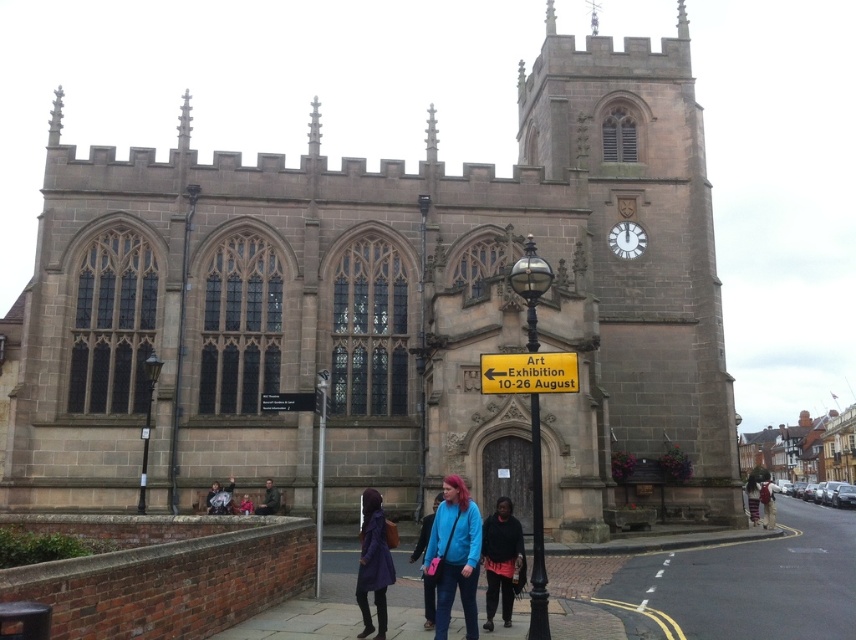
Does blue fabric jacket at center have a lesser width compared to white glossy clock at upper right?

No, blue fabric jacket at center is not thinner than white glossy clock at upper right.

Between blue fabric jacket at center and white glossy clock at upper right, which one has less height?

white glossy clock at upper right

Does point (420, 531) come closer to viewer compared to point (628, 230)?

Yes, it is in front of point (628, 230).

At what (x,y) coordinates should I click in order to perform the action: click on blue fabric jacket at center. Please return your answer as a coordinate pair (x, y). Looking at the image, I should click on (425, 531).

Can you confirm if dark purple fabric coat at lower center is smaller than dark brown leather jacket at lower center?

Actually, dark purple fabric coat at lower center might be larger than dark brown leather jacket at lower center.

Is dark purple fabric coat at lower center below dark brown leather jacket at lower center?

Correct, dark purple fabric coat at lower center is located below dark brown leather jacket at lower center.

Is point (379, 573) positioned before point (278, 502)?

Yes, it is.

Identify the location of dark purple fabric coat at lower center. pos(373,563).

Which is more to the right, dark blue sweater at center or blue fabric jacket at center?

dark blue sweater at center

Is dark blue sweater at center further to the viewer compared to blue fabric jacket at center?

No.

Where is `dark blue sweater at center`? dark blue sweater at center is located at coordinates [x=500, y=560].